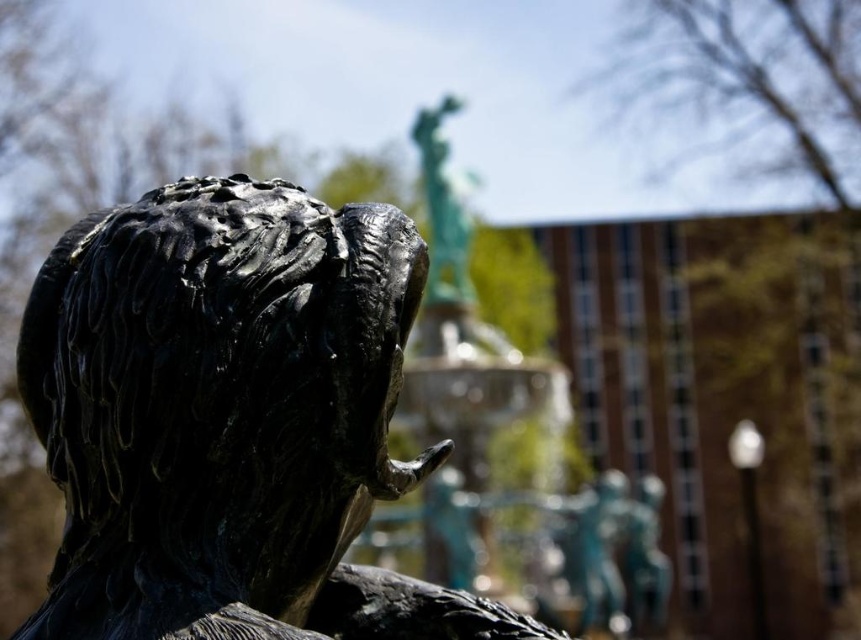
You are an art curator planning to display the shiny black statue at center and the green patina statue at upper center in a new exhibition. If you want to place them side by side on a shelf, which statue should be placed first to ensure they fit without overlapping?

The shiny black statue at center is wider than the green patina statue at upper center, so you should place the shiny black statue at center first to accommodate its larger width before positioning the narrower green patina statue at upper center next to it.

You are an art student analyzing the sculpture arrangement in the image. You notice the shiny black statue at center and the green patina statue at upper center. Which statue is located to the left of the other?

The shiny black statue at center is positioned on the left side of green patina statue at upper center.

You are an art curator planning to display both the shiny black statue at center and the green patina statue at upper center in a gallery. Based on their sizes, which statue should be placed closer to the entrance to ensure visitors notice the larger one first?

The green patina statue at upper center should be placed closer to the entrance because it occupies more space than the shiny black statue at center, making it more noticeable to visitors entering the gallery.